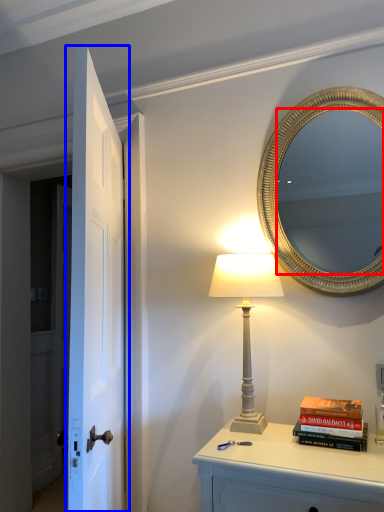
Question: Which object appears farthest to the camera in this image, mirror (highlighted by a red box) or door (highlighted by a blue box)?

Choices:
 (A) mirror
 (B) door

Answer: (A)